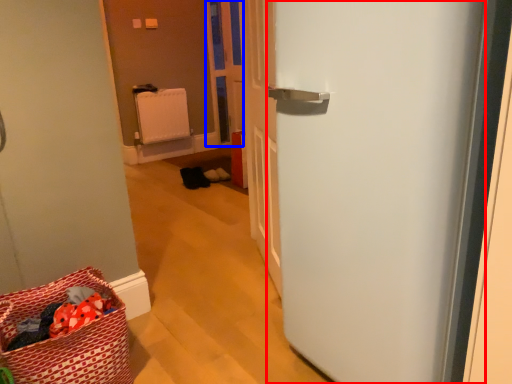
Question: Which point is further to the camera, door (highlighted by a red box) or screen door (highlighted by a blue box)?

Choices:
 (A) door
 (B) screen door

Answer: (B)